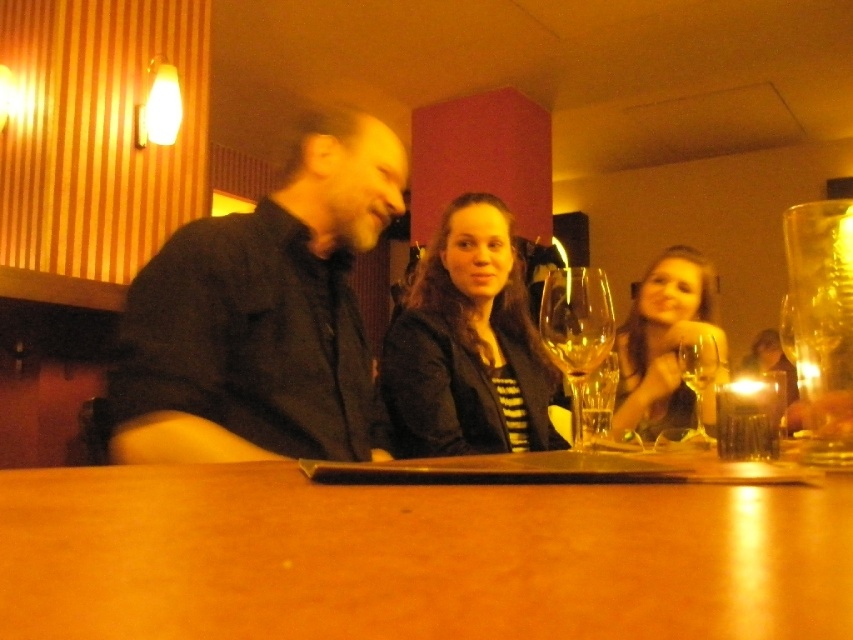
Image resolution: width=853 pixels, height=640 pixels. Find the location of `transparent glass wine glass at right`. transparent glass wine glass at right is located at coordinates (698, 380).

In order to click on transparent glass wine glass at right in this screenshot , I will do `click(698, 380)`.

Where is `transparent glass wine glass at right`? transparent glass wine glass at right is located at coordinates (698, 380).

Is transparent glass wine glass at right behind clear glass at center?

Yes, it is.

Which is in front, point (705, 435) or point (589, 426)?

Point (589, 426) is more forward.

Image resolution: width=853 pixels, height=640 pixels. Identify the location of transparent glass wine glass at right. (698, 380).

Between smooth black hair at upper right and translucent glass candle at upper right, which one appears on the left side from the viewer's perspective?

translucent glass candle at upper right

Does smooth black hair at upper right appear under translucent glass candle at upper right?

Actually, smooth black hair at upper right is above translucent glass candle at upper right.

Measure the distance between smooth black hair at upper right and camera.

smooth black hair at upper right and camera are 1.24 meters apart.

Identify the location of smooth black hair at upper right. (664, 342).